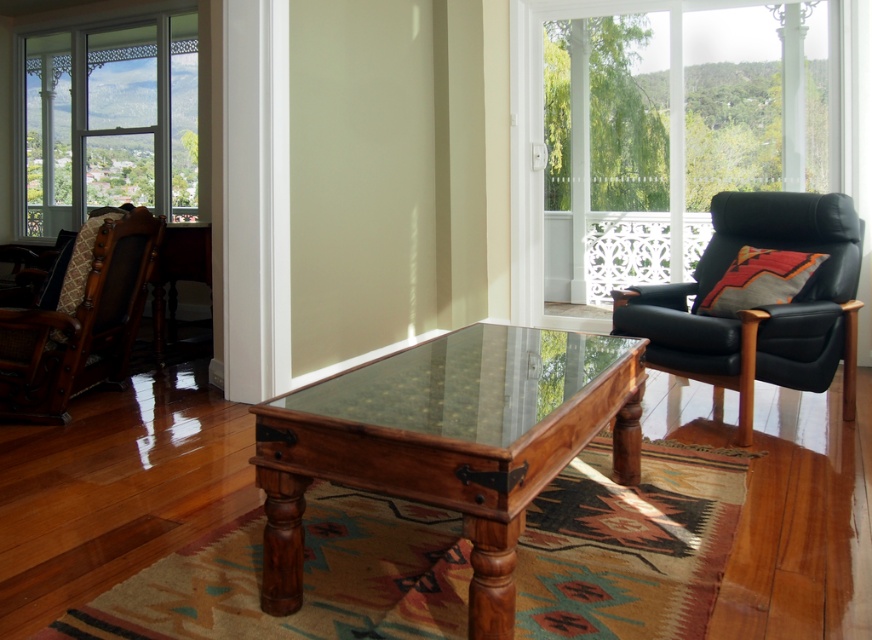
Which is more to the left, black leather armchair at right or brown woven fabric rocking chair at left?

brown woven fabric rocking chair at left is more to the left.

Based on the photo, measure the distance from black leather armchair at right to brown woven fabric rocking chair at left.

black leather armchair at right is 2.78 meters from brown woven fabric rocking chair at left.

Where is `black leather armchair at right`? Image resolution: width=872 pixels, height=640 pixels. black leather armchair at right is located at coordinates (760, 305).

Which is below, brown wood table at center or clear glass window at upper left?

brown wood table at center is below.

Describe the element at coordinates (448, 442) in the screenshot. I see `brown wood table at center` at that location.

You are a GUI agent. You are given a task and a screenshot of the screen. Output one action in this format:
    pyautogui.click(x=<x>, y=<y>)
    Task: Click on the brown wood table at center
    This screenshot has width=872, height=640.
    Given the screenshot: What is the action you would take?
    pyautogui.click(x=448, y=442)

Which is in front, point (116, 132) or point (710, 285)?

Point (710, 285)

Between clear glass window at upper left and black leather armchair at right, which one is positioned lower?

black leather armchair at right is below.

Find the location of a particular element. clear glass window at upper left is located at coordinates 107,122.